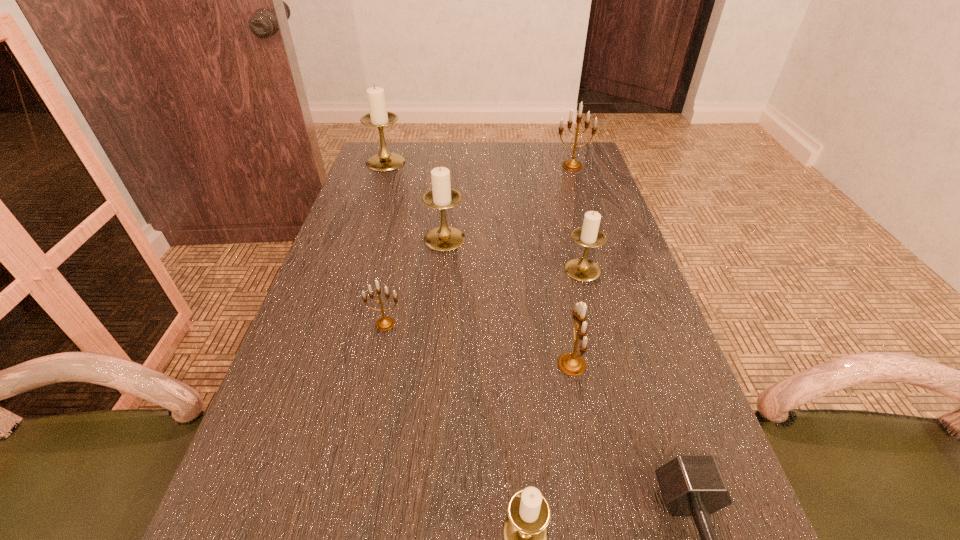
Identify the location of vacant space at the far edge. (441, 165).

Image resolution: width=960 pixels, height=540 pixels. Identify the location of free space at the left edge. (341, 264).

Where is `free location at the right edge of the desktop`? Image resolution: width=960 pixels, height=540 pixels. free location at the right edge of the desktop is located at coordinates (601, 295).

Find the location of `free region at the far right corner`. free region at the far right corner is located at coordinates (586, 154).

Locate an element on the screen. vacant area that lies between the third biggest white candle holder and the fifth farthest object is located at coordinates (484, 297).

Where is `free space between the tallest candle holder and the second biggest white candle holder`? The height and width of the screenshot is (540, 960). free space between the tallest candle holder and the second biggest white candle holder is located at coordinates (416, 201).

Find the location of a particular element. The width and height of the screenshot is (960, 540). free space between the third nearest candle holder and the farthest gold candelabrum is located at coordinates (479, 245).

The image size is (960, 540). I want to click on free area in between the second object from left to right and the fourth farthest candle holder, so tap(484, 297).

At what (x,y) coordinates should I click in order to perform the action: click on unoccupied position between the third farthest candle holder and the rightmost gold candelabrum. Please return your answer as a coordinate pair (x, y). This screenshot has height=540, width=960. Looking at the image, I should click on (509, 202).

The height and width of the screenshot is (540, 960). I want to click on free space between the third farthest candle holder and the second candle holder from left to right, so click(x=415, y=281).